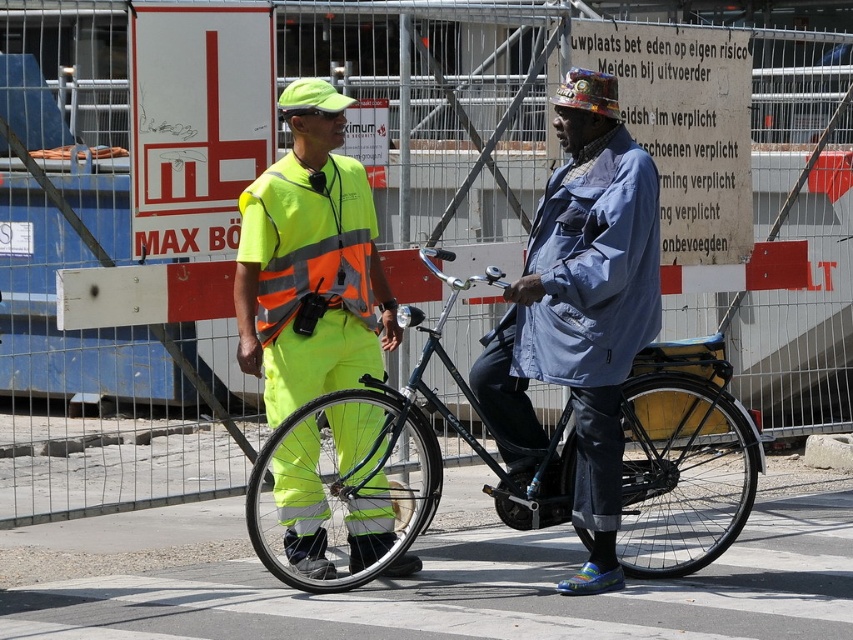
In the scene shown: You are a delivery person who needs to pass by both the denim jacket at center and the shiny black bicycle at center. The path between them is narrow. What is the minimum width you need to safely pass through?

The minimum width required to safely pass through the path between the denim jacket at center and the shiny black bicycle at center is 21.31 inches, as that is the distance between them.

You are a delivery person who needs to quickly pass through the area where the denim jacket at center and the shiny black bicycle at center are located. Based on their sizes, which object should you maneuver around to ensure enough space for your delivery cart?

The denim jacket at center occupies less space than the shiny black bicycle at center, so you should maneuver around the denim jacket at center to ensure enough space for your delivery cart.